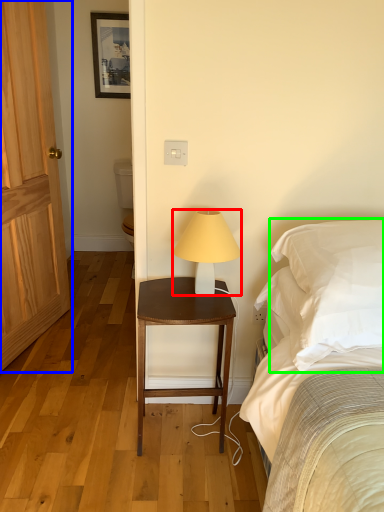
Question: Which object is positioned closest to lamp (highlighted by a red box)? Select from door (highlighted by a blue box) and pillow (highlighted by a green box).

Choices:
 (A) door
 (B) pillow

Answer: (B)